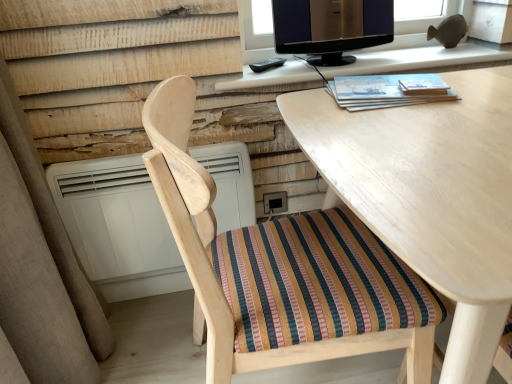
Question: Is matte black monitor at upper center facing away from light wood desk at center?

Choices:
 (A) no
 (B) yes

Answer: (A)

Question: Can you confirm if matte black monitor at upper center is bigger than light wood desk at center?

Choices:
 (A) yes
 (B) no

Answer: (B)

Question: From a real-world perspective, is matte black monitor at upper center positioned over light wood desk at center based on gravity?

Choices:
 (A) yes
 (B) no

Answer: (A)

Question: From the image's perspective, is matte black monitor at upper center below light wood desk at center?

Choices:
 (A) yes
 (B) no

Answer: (B)

Question: Is matte black monitor at upper center touching light wood desk at center?

Choices:
 (A) no
 (B) yes

Answer: (A)

Question: Looking at their shapes, would you say white plastic air conditioner at lower left is wider or thinner than matte black monitor at upper center?

Choices:
 (A) wide
 (B) thin

Answer: (B)

Question: Would you say white plastic air conditioner at lower left is to the left or to the right of matte black monitor at upper center in the picture?

Choices:
 (A) left
 (B) right

Answer: (A)

Question: Is white plastic air conditioner at lower left inside the boundaries of matte black monitor at upper center, or outside?

Choices:
 (A) inside
 (B) outside

Answer: (B)

Question: From the image's perspective, relative to matte black monitor at upper center, is white plastic air conditioner at lower left above or below?

Choices:
 (A) above
 (B) below

Answer: (B)

Question: Considering the positions of point (83, 251) and point (309, 8), is point (83, 251) closer or farther from the camera than point (309, 8)?

Choices:
 (A) closer
 (B) farther

Answer: (B)

Question: Is white plastic air conditioner at lower left inside the boundaries of black glossy monitor at upper center, or outside?

Choices:
 (A) inside
 (B) outside

Answer: (B)

Question: From a real-world perspective, is white plastic air conditioner at lower left positioned above or below black glossy monitor at upper center?

Choices:
 (A) above
 (B) below

Answer: (B)

Question: In the image, is white plastic air conditioner at lower left on the left side or the right side of black glossy monitor at upper center?

Choices:
 (A) right
 (B) left

Answer: (B)

Question: From a real-world perspective, is black glossy monitor at upper center above or below wooden chair with striped cushion at center?

Choices:
 (A) above
 (B) below

Answer: (A)

Question: Relative to wooden chair with striped cushion at center, is black glossy monitor at upper center in front or behind?

Choices:
 (A) behind
 (B) front

Answer: (A)